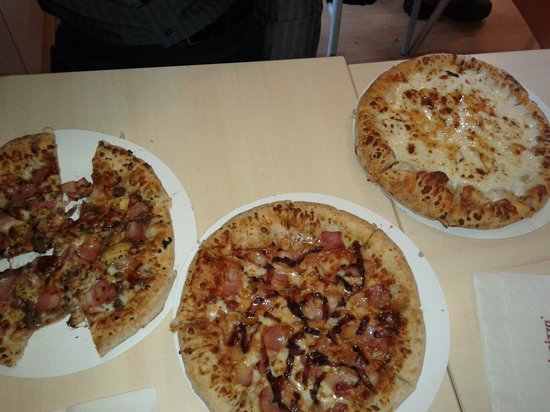
This screenshot has height=412, width=550. I want to click on napkin, so click(141, 399).